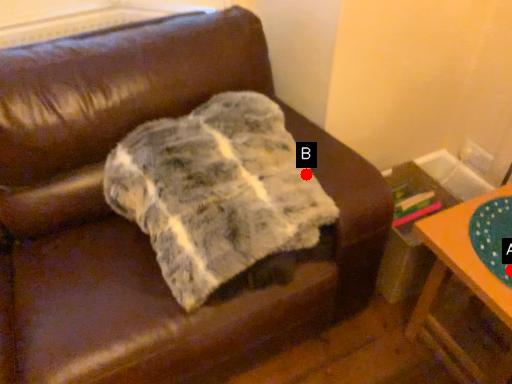
Question: Two points are circled on the image, labeled by A and B beside each circle. Which point is further to the camera?

Choices:
 (A) A is further
 (B) B is further

Answer: (B)